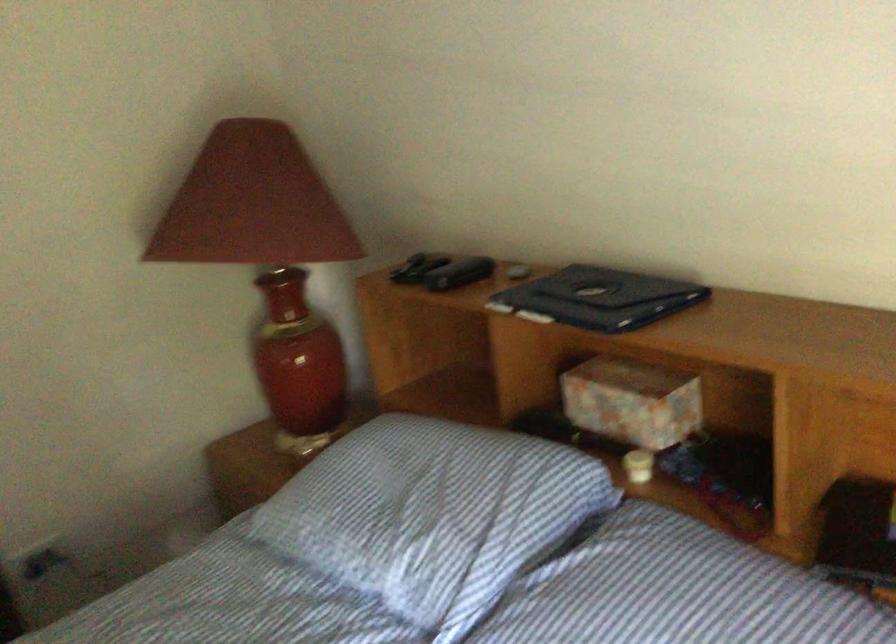
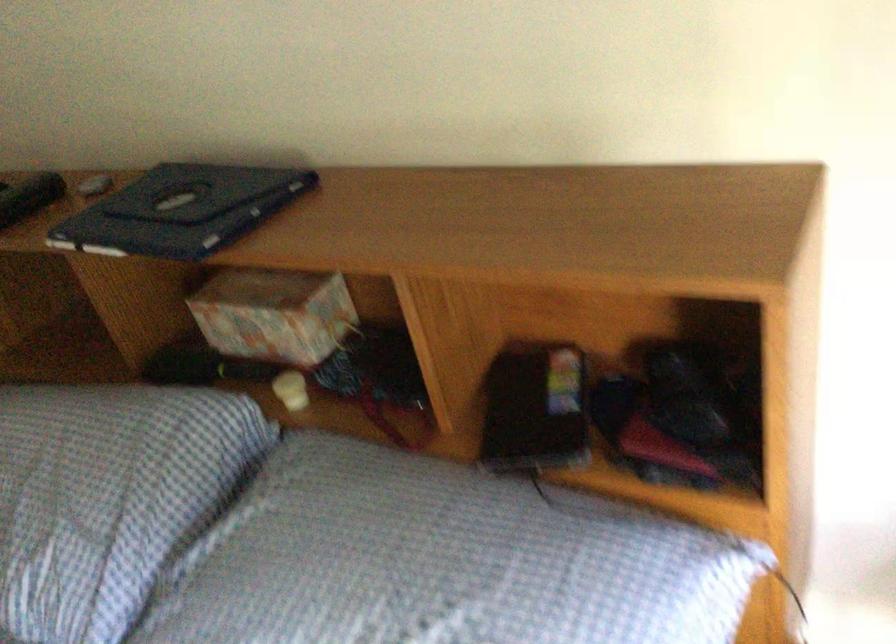
Question: The camera is either moving clockwise (left) or counter-clockwise (right) around the object. The first image is from the beginning of the video and the second image is from the end. Is the camera moving left or right when shooting the video?

Choices:
 (A) Left
 (B) Right

Answer: (A)